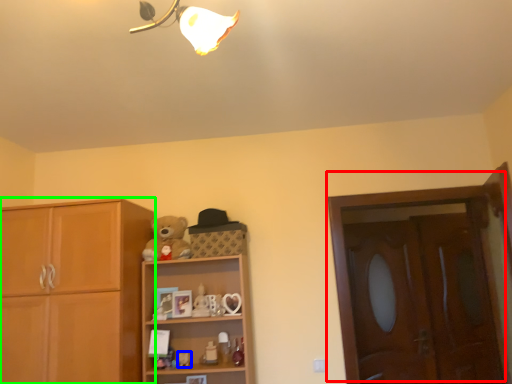
Question: Which is farther away from door (highlighted by a red box)? toy (highlighted by a blue box) or cabinetry (highlighted by a green box)?

Choices:
 (A) toy
 (B) cabinetry

Answer: (B)